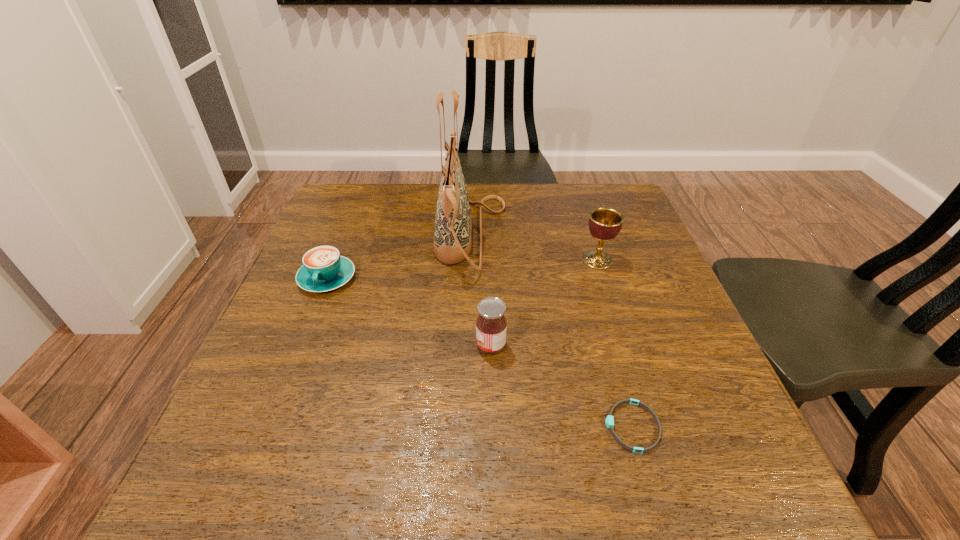
Find the location of a particular element. The height and width of the screenshot is (540, 960). chalice that is at the right edge is located at coordinates (605, 223).

This screenshot has width=960, height=540. I want to click on wristband situated at the right edge, so click(x=609, y=420).

I want to click on object that is at the near right corner, so click(609, 420).

Where is `vacant area at the far edge`? Image resolution: width=960 pixels, height=540 pixels. vacant area at the far edge is located at coordinates (397, 200).

Identify the location of blank area at the near edge. The width and height of the screenshot is (960, 540). (484, 501).

The height and width of the screenshot is (540, 960). Find the location of `free location at the left edge`. free location at the left edge is located at coordinates tap(298, 327).

In the image, there is a desktop. Identify the location of free space at the right edge. This screenshot has width=960, height=540. (751, 442).

Locate an element on the screen. The image size is (960, 540). free region at the far left corner of the desktop is located at coordinates (325, 208).

Locate an element on the screen. The height and width of the screenshot is (540, 960). free point at the near left corner is located at coordinates (218, 488).

Where is `vacant space at the far right corner of the desktop`? This screenshot has width=960, height=540. vacant space at the far right corner of the desktop is located at coordinates (612, 191).